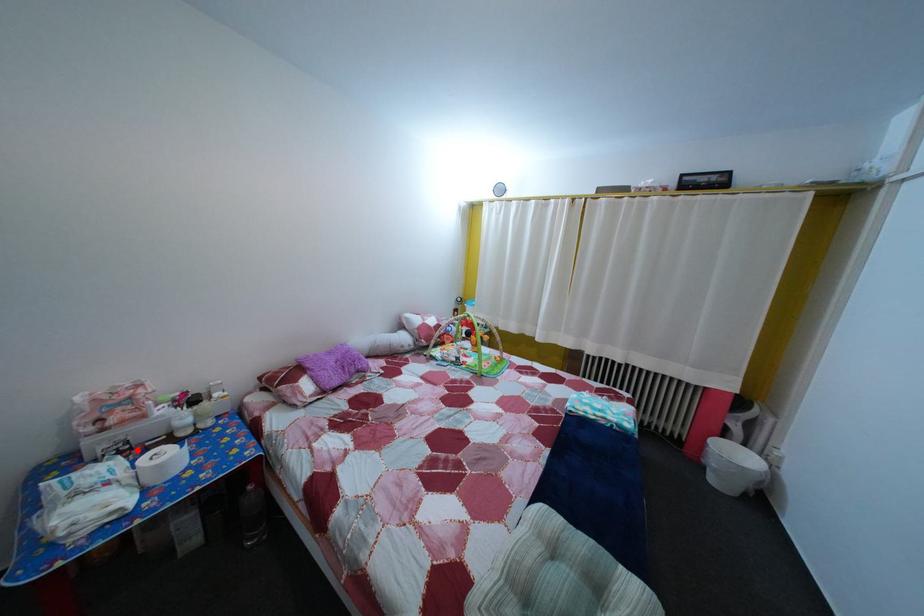
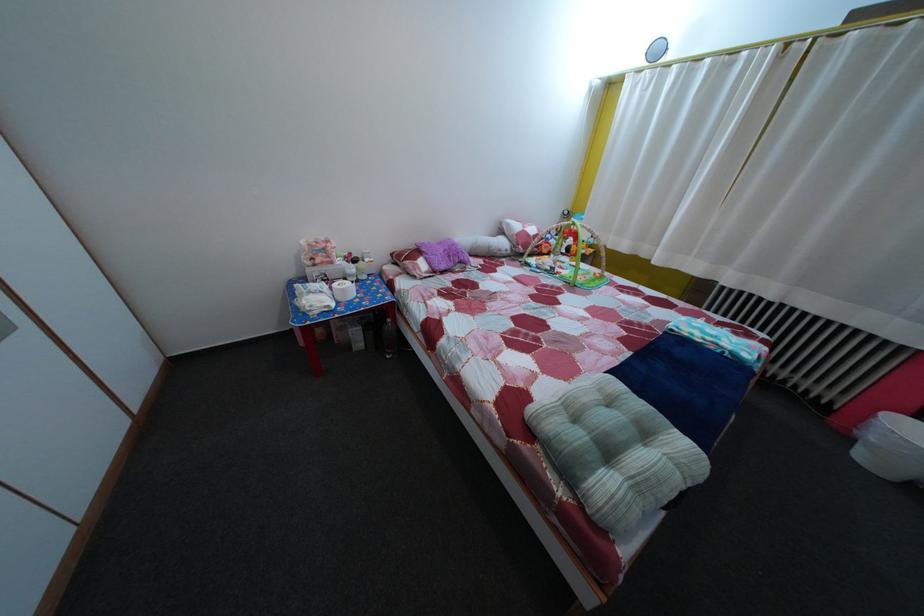
Find the pixel in the second image that matches the highlighted location in the first image.

(335, 284)